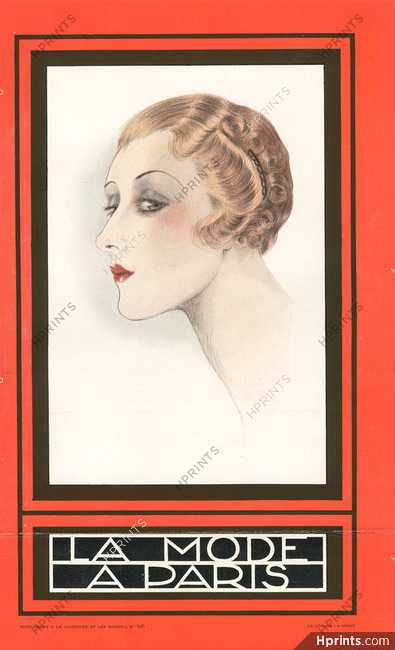
I want to click on inside black frame, so click(x=43, y=396), click(x=161, y=489), click(x=329, y=281), click(x=184, y=58).